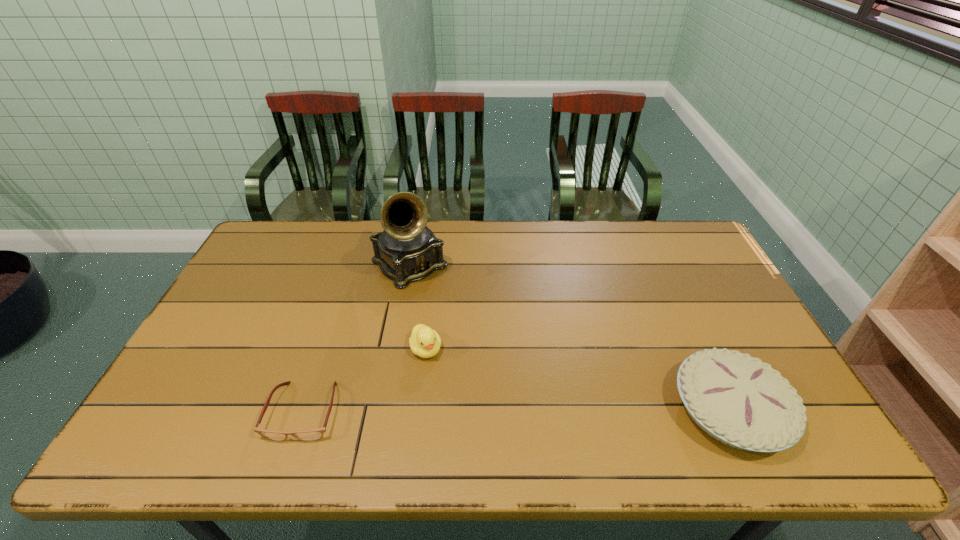
Find the location of `object that is the third closest to the spectacles`. object that is the third closest to the spectacles is located at coordinates (737, 399).

At what (x,y) coordinates should I click in order to perform the action: click on object that is the second closest one to the pie. Please return your answer as a coordinate pair (x, y). Looking at the image, I should click on (407, 250).

The image size is (960, 540). What are the coordinates of `vacant space that satisfies the following two spatial constraints: 1. on the front side of the rightmost object; 2. on the left side of the duckling` in the screenshot? It's located at (420, 409).

Locate an element on the screen. This screenshot has width=960, height=540. free spot that satisfies the following two spatial constraints: 1. on the front side of the duckling; 2. on the right side of the farthest object is located at coordinates (394, 349).